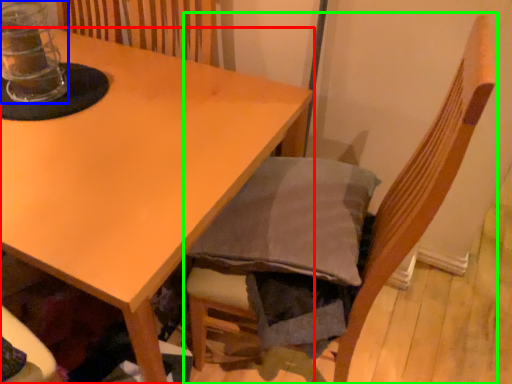
Question: Which is nearer to the table (highlighted by a red box)? glass jar (highlighted by a blue box) or chair (highlighted by a green box).

Choices:
 (A) glass jar
 (B) chair

Answer: (A)